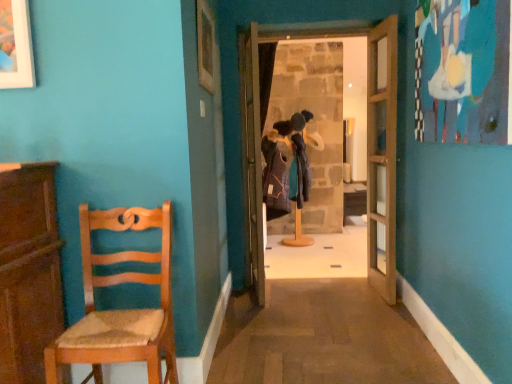
What do you see at coordinates (252, 157) in the screenshot?
I see `wooden coat rack at center, which is the third door in right-to-left order` at bounding box center [252, 157].

Locate an element on the screen. The height and width of the screenshot is (384, 512). wooden table at center is located at coordinates (354, 200).

Measure the distance between wooden coat rack at center, which is the second door in right-to-left order, and camera.

wooden coat rack at center, which is the second door in right-to-left order, and camera are 2.86 meters apart.

Measure the distance between wooden picture frame at upper center and camera.

They are 7.11 feet apart.

The width and height of the screenshot is (512, 384). Identify the location of wooden door at center, the 1th door from the right. (382, 156).

Are wooden coat rack at center, which is the second door in right-to-left order, and wooden table at center far apart?

Indeed, wooden coat rack at center, which is the second door in right-to-left order, is not near wooden table at center.

Is the position of wooden coat rack at center, which is counted as the second door, starting from the left, more distant than that of wooden table at center?

That is False.

In the scene shown: Does wooden coat rack at center, which is the second door in right-to-left order, turn towards wooden table at center?

No, wooden coat rack at center, which is the second door in right-to-left order, is not turned towards wooden table at center.

Which of these two, wooden coat rack at center, which is the second door in right-to-left order, or wooden table at center, stands shorter?

With less height is wooden table at center.

Is wooden door at center, the 1th door from the right, not within wooden table at center?

wooden door at center, the 1th door from the right, lies outside wooden table at center's area.

Could you tell me if wooden door at center, placed as the third door when sorted from left to right, is turned towards wooden table at center?

No, wooden door at center, placed as the third door when sorted from left to right, is not facing towards wooden table at center.

From a real-world perspective, which object stands above the other?

wooden door at center, placed as the third door when sorted from left to right, is physically above.

From the image's perspective, which one is positioned higher, wooden coat rack at center, which is counted as the second door, starting from the left, or wooden picture frame at upper center?

wooden picture frame at upper center is shown above in the image.

Based on the photo, is wooden coat rack at center, which is the second door in right-to-left order, outside of wooden picture frame at upper center?

Yes, wooden coat rack at center, which is the second door in right-to-left order, is outside of wooden picture frame at upper center.

Is wooden coat rack at center, which is the second door in right-to-left order, taller or shorter than wooden picture frame at upper center?

wooden coat rack at center, which is the second door in right-to-left order, is taller than wooden picture frame at upper center.

Does wooden table at center have a lesser height compared to woven wood chair at left?

Yes.

Looking at this image, choose the correct answer: Is wooden table at center inside woven wood chair at left or outside it?

wooden table at center is not inside woven wood chair at left, it's outside.

Is wooden table at center oriented away from woven wood chair at left?

No, wooden table at center is not facing away from woven wood chair at left.

How much distance is there between wooden table at center and woven wood chair at left?

They are 17.31 feet apart.

Which object is thinner, wooden coat rack at center, which is the third door in right-to-left order, or woven wood chair at left?

wooden coat rack at center, which is the third door in right-to-left order, is thinner.

Which of these two, wooden coat rack at center, which is the third door in right-to-left order, or woven wood chair at left, is bigger?

woven wood chair at left is bigger.

Choose the correct answer: Is wooden coat rack at center, which appears as the first door when viewed from the left, inside woven wood chair at left or outside it?

wooden coat rack at center, which appears as the first door when viewed from the left, is not inside woven wood chair at left, it's outside.

Could you tell me if wooden coat rack at center, which is the third door in right-to-left order, is turned towards woven wood chair at left?

No, wooden coat rack at center, which is the third door in right-to-left order, is not oriented towards woven wood chair at left.

Considering the sizes of objects wooden picture frame at upper center and wooden coat rack at center, which is the second door in right-to-left order, in the image provided, who is smaller, wooden picture frame at upper center or wooden coat rack at center, which is the second door in right-to-left order,?

wooden picture frame at upper center.

In terms of width, does wooden picture frame at upper center look wider or thinner when compared to wooden coat rack at center, which is counted as the second door, starting from the left?

Considering their sizes, wooden picture frame at upper center looks slimmer than wooden coat rack at center, which is counted as the second door, starting from the left.

Is wooden picture frame at upper center looking in the opposite direction of wooden coat rack at center, which is the second door in right-to-left order?

No, wooden picture frame at upper center's orientation is not away from wooden coat rack at center, which is the second door in right-to-left order.

Is wooden door at center, placed as the third door when sorted from left to right, behind wooden coat rack at center, which appears as the first door when viewed from the left?

No, wooden door at center, placed as the third door when sorted from left to right, is in front of wooden coat rack at center, which appears as the first door when viewed from the left.

How different are the orientations of wooden door at center, the 1th door from the right, and wooden coat rack at center, which is the third door in right-to-left order, in degrees?

There is a 175-degree angle between the facing directions of wooden door at center, the 1th door from the right, and wooden coat rack at center, which is the third door in right-to-left order.

In terms of width, does wooden door at center, placed as the third door when sorted from left to right, look wider or thinner when compared to wooden coat rack at center, which appears as the first door when viewed from the left?

In the image, wooden door at center, placed as the third door when sorted from left to right, appears to be wider than wooden coat rack at center, which appears as the first door when viewed from the left.

Is wooden door at center, the 1th door from the right, not inside wooden coat rack at center, which appears as the first door when viewed from the left?

wooden door at center, the 1th door from the right, lies outside wooden coat rack at center, which appears as the first door when viewed from the left,'s area.

This screenshot has width=512, height=384. What are the coordinates of `the 2nd door counting from the left side of the wooden table at center` in the screenshot? It's located at (324, 136).

Starting from the wooden table at center, which door is the 3rd one in front? Please provide its 2D coordinates.

[(382, 156)]

Which object lies further to the anchor point woven wood chair at left, wooden table at center or wooden picture frame at upper center?

wooden table at center is further to woven wood chair at left.

When comparing their distances from wooden door at center, the 1th door from the right, does woven wood chair at left or wooden picture frame at upper center seem further?

woven wood chair at left is positioned further to the anchor wooden door at center, the 1th door from the right.

From the image, which object appears to be nearer to wooden door at center, placed as the third door when sorted from left to right, wooden coat rack at center, which appears as the first door when viewed from the left, or wooden table at center?

wooden coat rack at center, which appears as the first door when viewed from the left, is closer to wooden door at center, placed as the third door when sorted from left to right.

Looking at this image, from the image, which object appears to be farther from wooden picture frame at upper center, wooden table at center or woven wood chair at left?

wooden table at center lies further to wooden picture frame at upper center than the other object.

Which object lies further to the anchor point wooden door at center, placed as the third door when sorted from left to right, wooden table at center or wooden coat rack at center, which appears as the first door when viewed from the left?

wooden table at center is further to wooden door at center, placed as the third door when sorted from left to right.

Which object lies nearer to the anchor point woven wood chair at left, wooden coat rack at center, which is counted as the second door, starting from the left, or wooden picture frame at upper center?

Based on the image, wooden picture frame at upper center appears to be nearer to woven wood chair at left.

Which object lies further to the anchor point wooden coat rack at center, which appears as the first door when viewed from the left, wooden door at center, placed as the third door when sorted from left to right, or wooden coat rack at center, which is the second door in right-to-left order?

wooden door at center, placed as the third door when sorted from left to right, lies further to wooden coat rack at center, which appears as the first door when viewed from the left, than the other object.

Which object lies nearer to the anchor point woven wood chair at left, wooden picture frame at upper center or wooden coat rack at center, which appears as the first door when viewed from the left?

Among the two, wooden picture frame at upper center is located nearer to woven wood chair at left.

Locate an element on the screen. The image size is (512, 384). picture frame located between woven wood chair at left and wooden coat rack at center, which is the second door in right-to-left order, in the depth direction is located at coordinates (206, 46).

Identify the location of door situated between wooden coat rack at center, which appears as the first door when viewed from the left, and wooden door at center, placed as the third door when sorted from left to right, from left to right. (324, 136).

Locate an element on the screen. picture frame between woven wood chair at left and wooden table at center from front to back is located at coordinates (206, 46).

Locate an element on the screen. Image resolution: width=512 pixels, height=384 pixels. door located between wooden coat rack at center, which is the third door in right-to-left order, and wooden table at center in the depth direction is located at coordinates (324, 136).